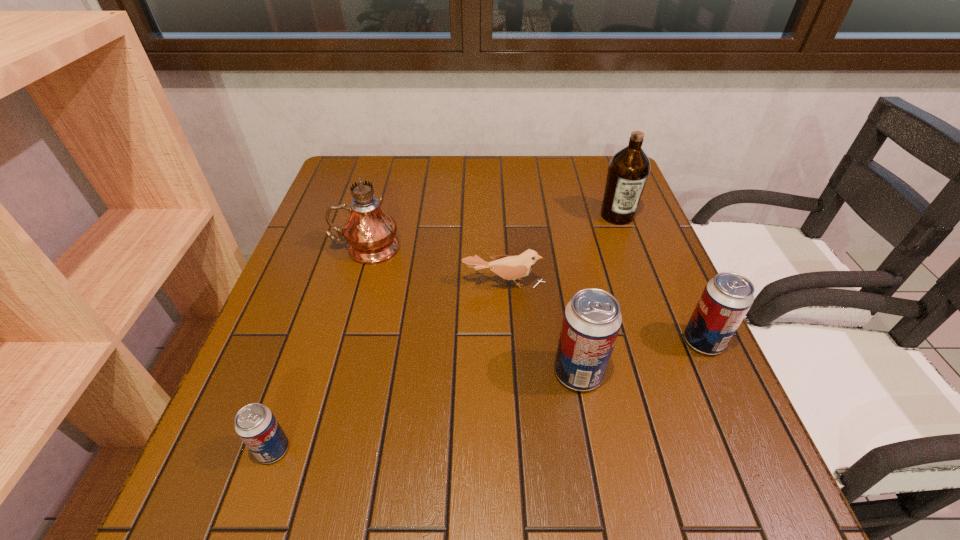
Identify the location of olive oil situated at the right edge. (628, 170).

Image resolution: width=960 pixels, height=540 pixels. I want to click on object present at the near left corner, so click(255, 424).

Locate an element on the screen. Image resolution: width=960 pixels, height=540 pixels. vacant point at the far edge is located at coordinates (410, 192).

Locate an element on the screen. This screenshot has height=540, width=960. free spot at the near edge of the desktop is located at coordinates (443, 429).

Find the location of `vacant position at the left edge of the desktop`. vacant position at the left edge of the desktop is located at coordinates (249, 392).

At what (x,y) coordinates should I click in order to perform the action: click on vacant space at the right edge. Please return your answer as a coordinate pair (x, y). The width and height of the screenshot is (960, 540). Looking at the image, I should click on (625, 346).

Where is `free region at the far left corner`? The height and width of the screenshot is (540, 960). free region at the far left corner is located at coordinates (391, 159).

What are the coordinates of `vacant space at the far right corner of the desktop` in the screenshot? It's located at (574, 163).

What are the coordinates of `vacant space at the near right corner of the desktop` in the screenshot? It's located at (734, 450).

Where is `free space that is in between the oil lamp and the second beer can from right to left`? free space that is in between the oil lamp and the second beer can from right to left is located at coordinates (x=472, y=310).